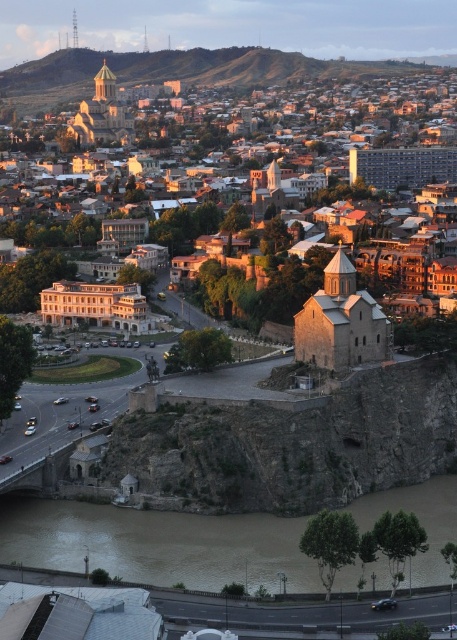
Does stone church at center appear on the left side of brown muddy water at lower center?

Incorrect, stone church at center is not on the left side of brown muddy water at lower center.

The image size is (457, 640). In order to click on stone church at center in this screenshot , I will do `click(303, 145)`.

At what (x,y) coordinates should I click in order to perform the action: click on stone church at center. Please return your answer as a coordinate pair (x, y). This screenshot has width=457, height=640. Looking at the image, I should click on (303, 145).

The height and width of the screenshot is (640, 457). In order to click on stone church at center in this screenshot , I will do `click(303, 145)`.